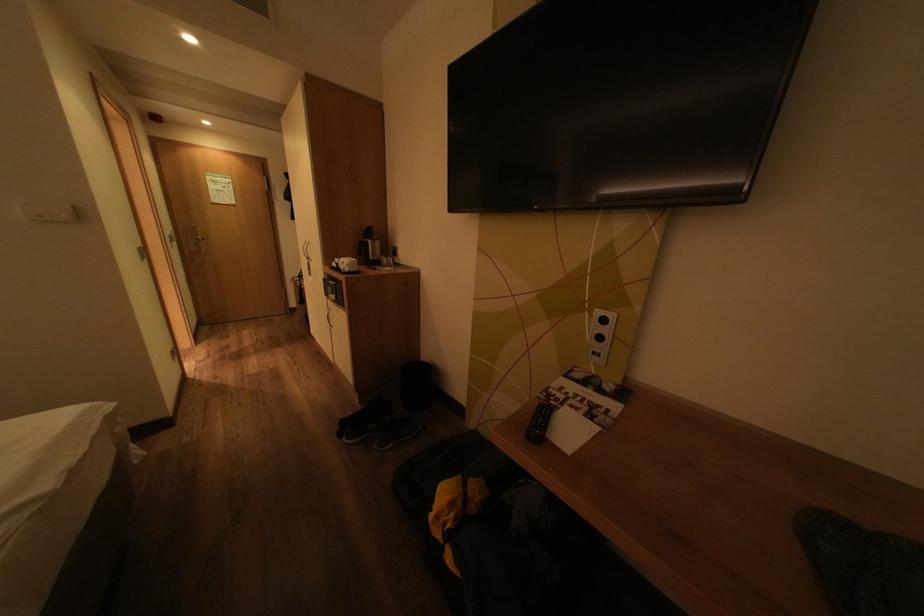
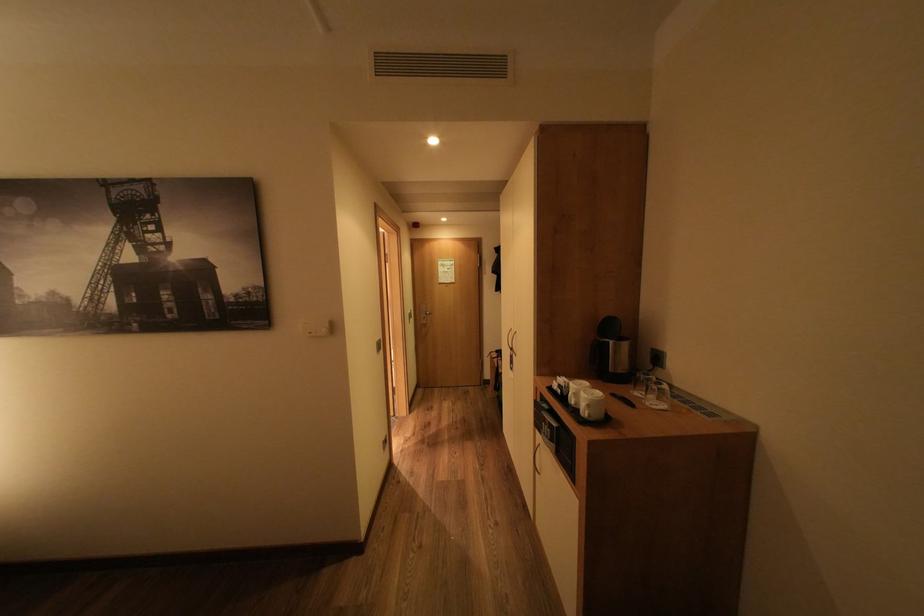
Find the pixel in the second image that matches (x=397, y=270) in the first image.

(664, 402)